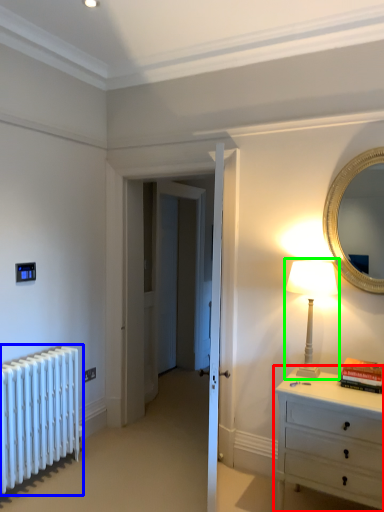
Question: Which object is the closest to the chest of drawers (highlighted by a red box)? Choose among these: radiator (highlighted by a blue box) or table lamp (highlighted by a green box).

Choices:
 (A) radiator
 (B) table lamp

Answer: (B)